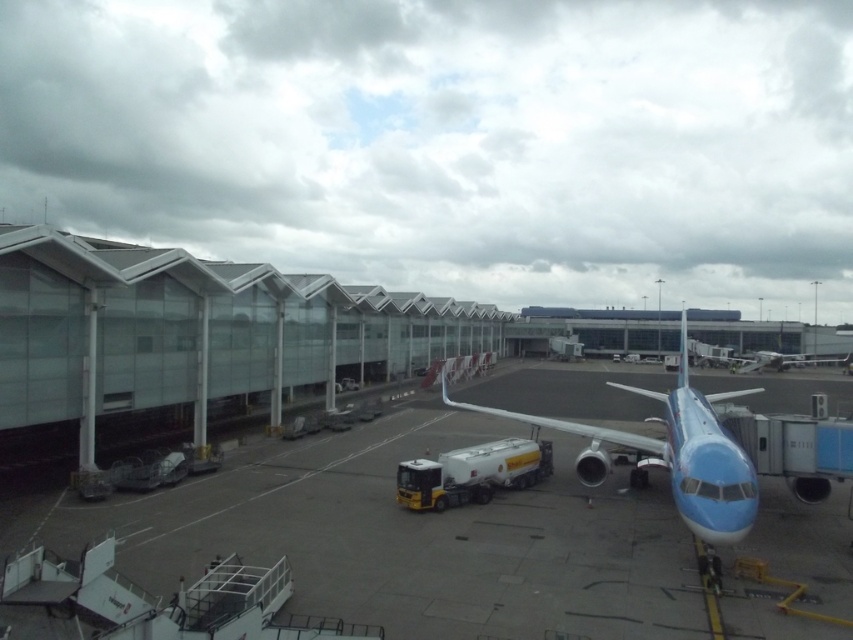
Question: Does smooth concrete tarmac at center come behind blue glossy airplane at center?

Choices:
 (A) no
 (B) yes

Answer: (A)

Question: From the image, what is the correct spatial relationship of smooth concrete tarmac at center in relation to blue glossy airplane at center?

Choices:
 (A) right
 (B) left

Answer: (B)

Question: Which point appears farthest from the camera in this image?

Choices:
 (A) (715, 506)
 (B) (325, 435)

Answer: (B)

Question: Is smooth concrete tarmac at center above blue glossy airplane at center?

Choices:
 (A) no
 (B) yes

Answer: (A)